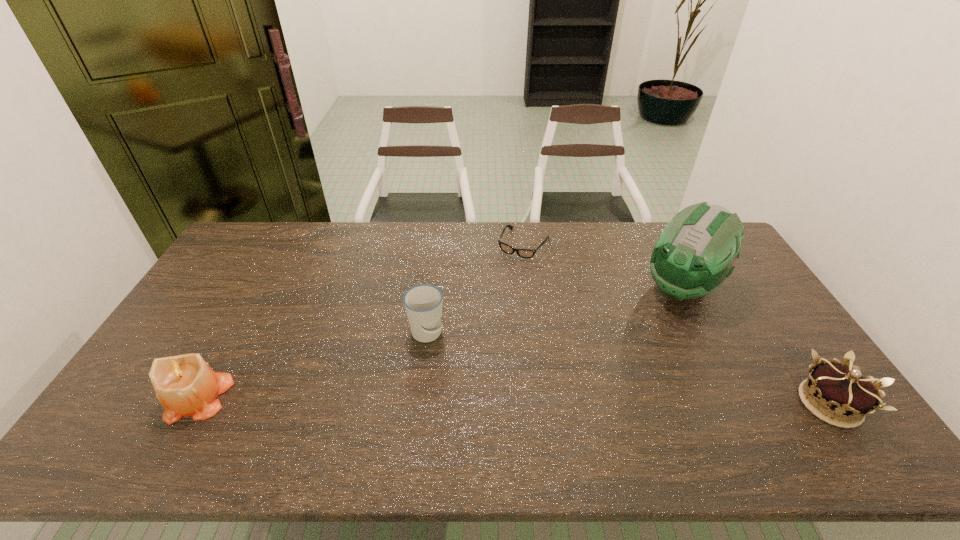
Where is `the leftmost object`? Image resolution: width=960 pixels, height=540 pixels. the leftmost object is located at coordinates (185, 385).

Identify the location of crown. This screenshot has width=960, height=540. (843, 397).

Identify the location of the third farthest object. (423, 303).

Where is `cup`? Image resolution: width=960 pixels, height=540 pixels. cup is located at coordinates point(423,303).

This screenshot has height=540, width=960. What are the coordinates of `the third object from left to right` in the screenshot? It's located at (523, 253).

The image size is (960, 540). Find the location of `spectacles`. spectacles is located at coordinates (523, 253).

At what (x,y) coordinates should I click in order to perform the action: click on football helmet. Please return your answer as a coordinate pair (x, y). The image size is (960, 540). Looking at the image, I should click on (695, 253).

Where is `free spot located on the right of the candle`? The width and height of the screenshot is (960, 540). free spot located on the right of the candle is located at coordinates (361, 398).

Locate an element on the screen. vacant space situated 0.070m on the back of the crown is located at coordinates (796, 354).

This screenshot has width=960, height=540. I want to click on free space located 0.160m with a handle on the side of the third farthest object, so click(456, 391).